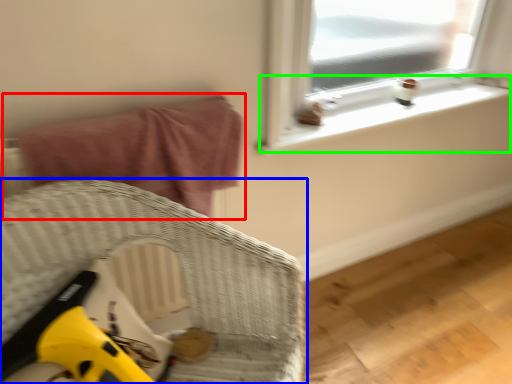
Question: Based on their relative distances, which object is nearer to bed (highlighted by a red box)? Choose from furniture (highlighted by a blue box) and window sill (highlighted by a green box).

Choices:
 (A) furniture
 (B) window sill

Answer: (A)